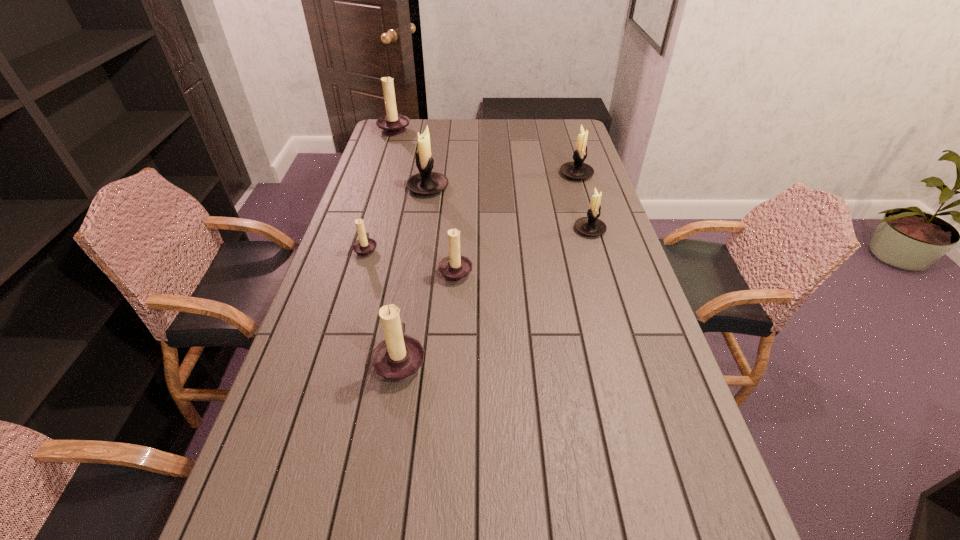
The image size is (960, 540). I want to click on the shortest object, so click(365, 246).

Where is `free spot located 0.150m on the wick of the biggest brown candle holder`? The height and width of the screenshot is (540, 960). free spot located 0.150m on the wick of the biggest brown candle holder is located at coordinates (444, 129).

In order to click on free location located on the front of the leftmost white candle holder in this screenshot , I will do `click(420, 234)`.

Locate an element on the screen. The image size is (960, 540). free space located on the wick of the second brown candle holder from right to left is located at coordinates (446, 360).

The height and width of the screenshot is (540, 960). Identify the location of vacant space located on the back of the second biggest white candle holder. (569, 152).

Identify the location of vacant space positioned 0.140m on the wick of the rightmost brown candle holder. (519, 271).

Find the location of a particular element. This screenshot has height=540, width=960. free space located on the back of the fourth farthest object is located at coordinates (580, 198).

At what (x,y) coordinates should I click in order to perform the action: click on free spot located on the wick of the shortest object. Please return your answer as a coordinate pair (x, y). Looking at the image, I should click on pos(485,249).

I want to click on object located at the far edge, so click(393, 124).

Locate an element on the screen. This screenshot has width=960, height=540. object present at the far left corner is located at coordinates (393, 124).